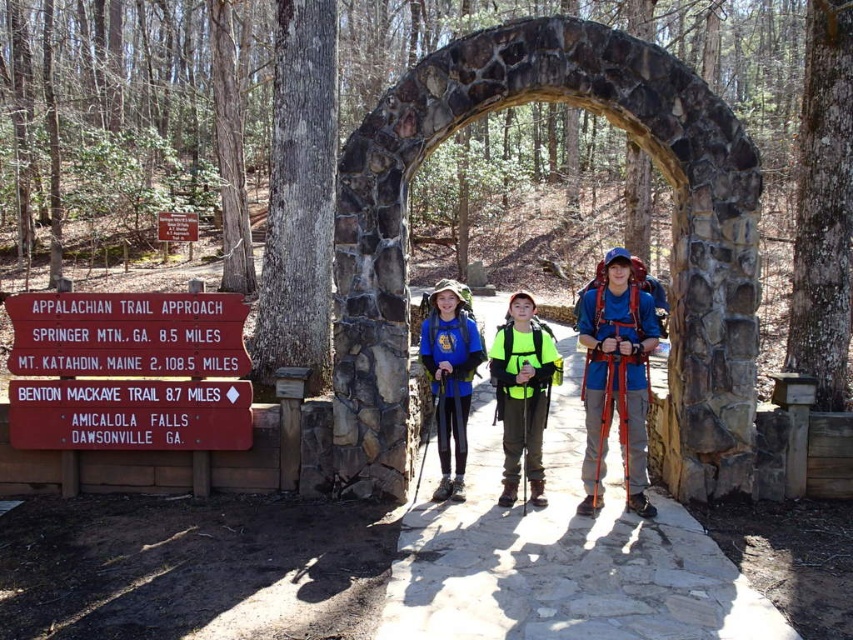
Who is positioned more to the right, stone archway at center or red wooden sign at left?

From the viewer's perspective, stone archway at center appears more on the right side.

The width and height of the screenshot is (853, 640). Identify the location of stone archway at center. (671, 236).

Identify the location of stone archway at center. The image size is (853, 640). (671, 236).

How far apart are red wooden sign at left and neon yellow vest at center?

red wooden sign at left and neon yellow vest at center are 10.29 feet apart.

Is point (129, 433) closer to viewer compared to point (537, 333)?

No, (129, 433) is behind (537, 333).

Is point (33, 428) positioned before point (502, 420)?

Yes, it is.

The height and width of the screenshot is (640, 853). I want to click on red wooden sign at left, so click(129, 369).

How far apart are stone archway at center and neon yellow life jacket at center?

stone archway at center and neon yellow life jacket at center are 4.79 feet apart.

Who is lower down, stone archway at center or neon yellow life jacket at center?

neon yellow life jacket at center is lower down.

What are the coordinates of `stone archway at center` in the screenshot? It's located at click(671, 236).

You are a GUI agent. You are given a task and a screenshot of the screen. Output one action in this format:
    pyautogui.click(x=<x>, y=<y>)
    Task: Click on the stone archway at center
    
    Given the screenshot: What is the action you would take?
    pyautogui.click(x=671, y=236)